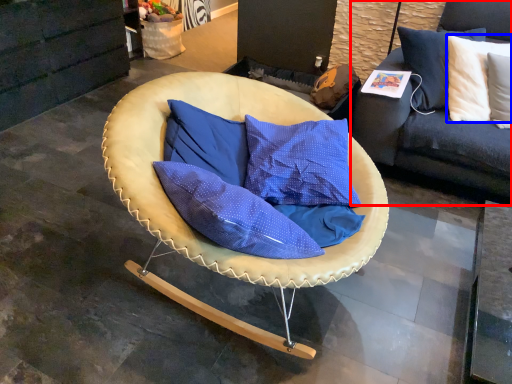
Question: Among these objects, which one is farthest to the camera, studio couch (highlighted by a red box) or pillow (highlighted by a blue box)?

Choices:
 (A) studio couch
 (B) pillow

Answer: (A)